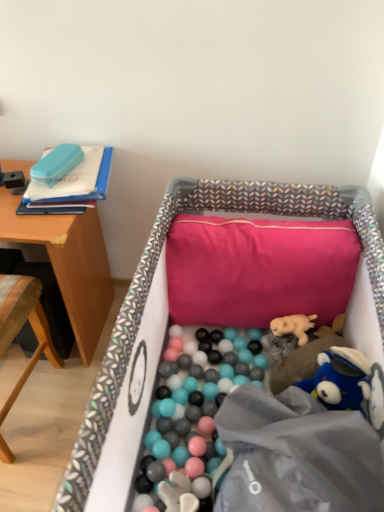
Question: From their relative heights in the image, would you say fabric-lined crib at center is taller or shorter than fluffy beige stuffed animal at center-right, positioned as the third toy in top-to-bottom order?

Choices:
 (A) short
 (B) tall

Answer: (B)

Question: Based on their sizes in the image, would you say fabric-lined crib at center is bigger or smaller than fluffy beige stuffed animal at center-right, positioned as the third toy in top-to-bottom order?

Choices:
 (A) small
 (B) big

Answer: (B)

Question: Based on their relative distances, which object is farther from the fabric-lined crib at center?

Choices:
 (A) fluffy beige stuffed animal at center-right, acting as the 3th toy starting from the left
 (B) wooden desk at left
 (C) matte blue pencil case at upper left, the 3th toy from the bottom
 (D) pink fabric pillow at center
 (E) wooden chair at left

Answer: (E)

Question: Which object is the closest to the fluffy beige plush at center, which appears as the 2th toy when viewed from the top?

Choices:
 (A) pink fabric pillow at center
 (B) wooden desk at left
 (C) fluffy beige stuffed animal at center-right, which is counted as the 1th toy, starting from the bottom
 (D) wooden chair at left
 (E) matte blue pencil case at upper left, which is the third toy from right to left

Answer: (C)